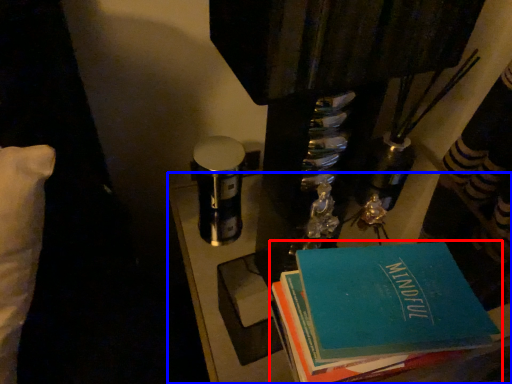
Question: Which object appears closest to the camera in this image, book (highlighted by a red box) or table (highlighted by a blue box)?

Choices:
 (A) book
 (B) table

Answer: (A)